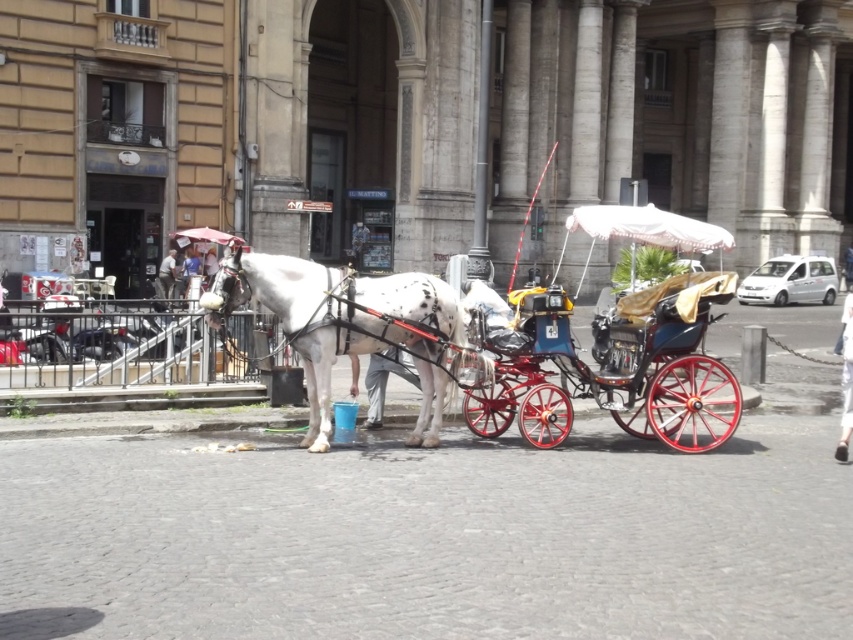
Is point (695, 340) positioned after point (172, 260)?

That is False.

In the scene shown: Between polished wood cart at center and white leather coach at center, which one appears on the left side from the viewer's perspective?

From the viewer's perspective, white leather coach at center appears more on the left side.

At what (x,y) coordinates should I click in order to perform the action: click on polished wood cart at center. Please return your answer as a coordinate pair (x, y). Looking at the image, I should click on (611, 368).

Where is `polished wood cart at center`? polished wood cart at center is located at coordinates (611, 368).

Is polished wood cart at center taller than white speckled fur at center?

Correct, polished wood cart at center is much taller as white speckled fur at center.

The image size is (853, 640). What do you see at coordinates (611, 368) in the screenshot? I see `polished wood cart at center` at bounding box center [611, 368].

Locate an element on the screen. polished wood cart at center is located at coordinates (611, 368).

This screenshot has height=640, width=853. Describe the element at coordinates (344, 324) in the screenshot. I see `white speckled fur at center` at that location.

Is white speckled fur at center to the right of white leather coach at center from the viewer's perspective?

Indeed, white speckled fur at center is positioned on the right side of white leather coach at center.

What are the coordinates of `white speckled fur at center` in the screenshot? It's located at (344, 324).